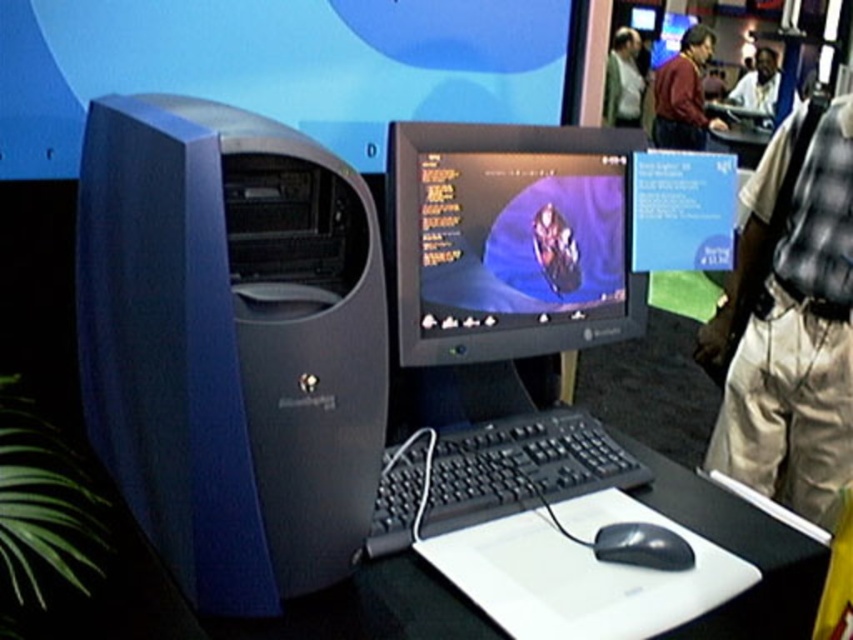
Question: Which object appears farthest from the camera in this image?

Choices:
 (A) light gray shirt at upper center
 (B) maroon sweater at center
 (C) blue plastic desktop computer at left
 (D) black leather jacket at upper right

Answer: (D)

Question: Can you confirm if maroon sweater at center is bigger than light gray shirt at upper center?

Choices:
 (A) no
 (B) yes

Answer: (B)

Question: From the image, what is the correct spatial relationship of maroon sweater at center in relation to black leather jacket at upper right?

Choices:
 (A) left
 (B) right

Answer: (A)

Question: Which is farther from the black glossy mouse at lower center?

Choices:
 (A) black leather jacket at upper right
 (B) light gray shirt at upper center
 (C) matte black monitor at center

Answer: (A)

Question: Among these points, which one is farthest from the camera?

Choices:
 (A) (300, 474)
 (B) (631, 147)
 (C) (630, 524)

Answer: (B)

Question: Can you confirm if light gray shirt at upper center is positioned to the right of black leather jacket at upper right?

Choices:
 (A) no
 (B) yes

Answer: (A)